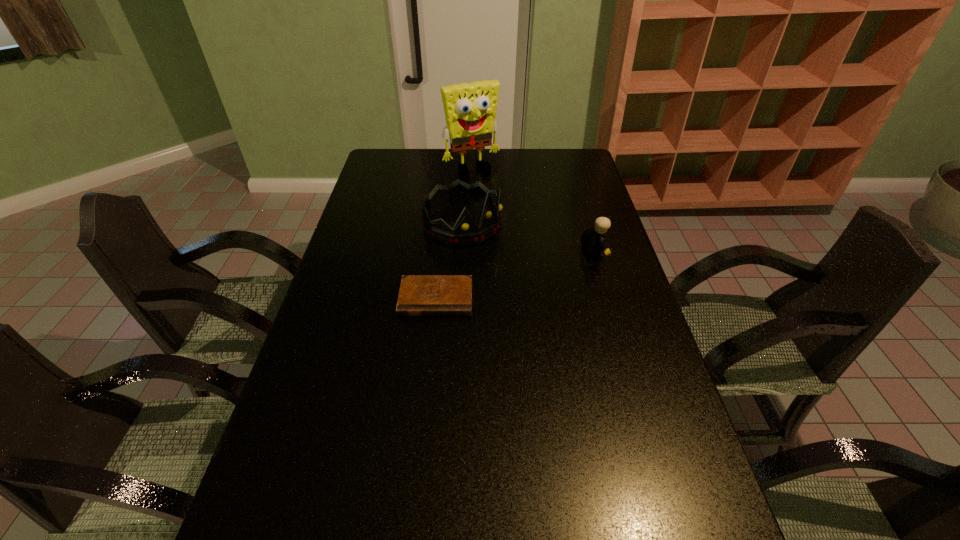
The width and height of the screenshot is (960, 540). Identify the location of the nearest object. (420, 295).

Find the location of `the shortest object`. the shortest object is located at coordinates (420, 295).

You are a GUI agent. You are given a task and a screenshot of the screen. Output one action in this format:
    pyautogui.click(x=<x>, y=<y>)
    Task: Click on the Lego
    Image resolution: width=960 pixels, height=540 pixels.
    Given the screenshot: What is the action you would take?
    pyautogui.click(x=593, y=239)

Where is `the rightmost object`? The height and width of the screenshot is (540, 960). the rightmost object is located at coordinates (593, 239).

Where is `the farthest object`? The height and width of the screenshot is (540, 960). the farthest object is located at coordinates (470, 108).

The height and width of the screenshot is (540, 960). What are the coordinates of `the tallest object` in the screenshot? It's located at (470, 108).

This screenshot has height=540, width=960. Find the location of `tiara`. tiara is located at coordinates (466, 232).

I want to click on vacant position located on the spine side of the shortest object, so 433,330.

Where is `vacant space located 0.370m on the face of the farthest object`? This screenshot has height=540, width=960. vacant space located 0.370m on the face of the farthest object is located at coordinates [519, 231].

The width and height of the screenshot is (960, 540). Identify the location of vacant point located 0.290m on the face of the farthest object. (510, 218).